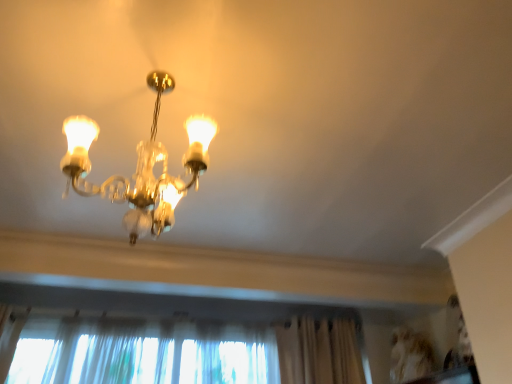
The width and height of the screenshot is (512, 384). What do you see at coordinates (140, 167) in the screenshot? I see `gold crystal chandelier at upper center` at bounding box center [140, 167].

You are a GUI agent. You are given a task and a screenshot of the screen. Output one action in this format:
    pyautogui.click(x=<x>, y=<y>)
    Task: Click on the gold crystal chandelier at upper center
    The height and width of the screenshot is (384, 512).
    Given the screenshot: What is the action you would take?
    pyautogui.click(x=140, y=167)

The width and height of the screenshot is (512, 384). Find the location of `gold crystal chandelier at upper center`. gold crystal chandelier at upper center is located at coordinates (140, 167).